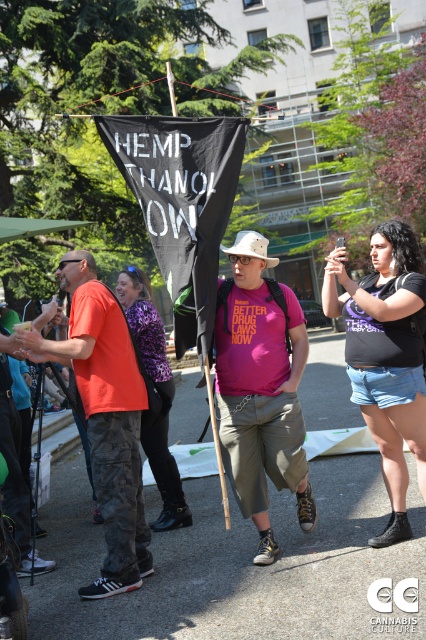
Does orange t-shirt at center appear on the left side of purple printed shirt at center?

Yes, orange t-shirt at center is to the left of purple printed shirt at center.

How much distance is there between orange t-shirt at center and purple printed shirt at center?

They are 70.54 centimeters apart.

Which is behind, point (118, 573) or point (149, 307)?

The point (149, 307) is behind.

At what (x,y) coordinates should I click in order to perform the action: click on orange t-shirt at center. Please return your answer as a coordinate pair (x, y). Looking at the image, I should click on (104, 417).

Between matte black t-shirt at center and purple printed shirt at center, which one is positioned higher?

Positioned higher is matte black t-shirt at center.

Which is more to the left, matte black t-shirt at center or purple printed shirt at center?

Positioned to the left is purple printed shirt at center.

Is point (380, 308) positioned in front of point (154, 372)?

Yes, it is in front of point (154, 372).

In order to click on matte black t-shirt at center in this screenshot , I will do `click(385, 356)`.

Image resolution: width=426 pixels, height=640 pixels. What are the coordinates of `pink matte t-shirt at center` in the screenshot? It's located at (261, 388).

Who is more distant from viewer, (298,440) or (129,294)?

Positioned behind is point (129,294).

Describe the element at coordinates (261, 388) in the screenshot. I see `pink matte t-shirt at center` at that location.

Where is `pink matte t-shirt at center`? pink matte t-shirt at center is located at coordinates (261, 388).